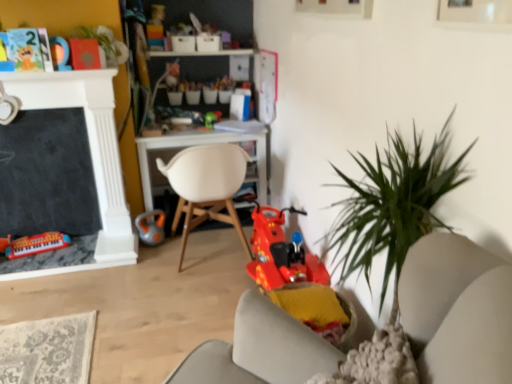
Locate an element on the screen. This screenshot has width=512, height=384. vacant space underneath white matte chair at center (from a real-world perspective) is located at coordinates (213, 253).